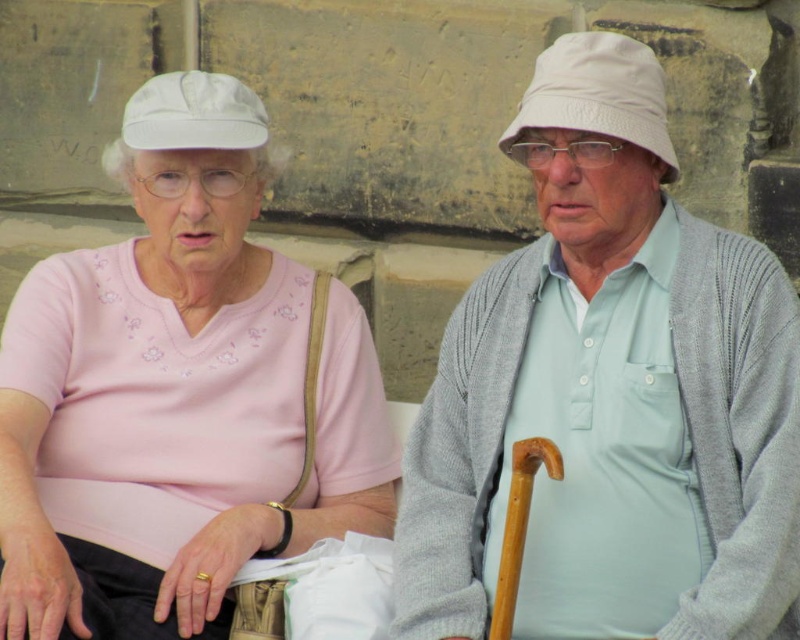
Question: Among these points, which one is farthest from the camera?

Choices:
 (A) (197, 540)
 (B) (146, 84)

Answer: (B)

Question: Which of the following is the closest to the observer?

Choices:
 (A) (612, 410)
 (B) (348, 513)

Answer: (A)

Question: Is matte pink shirt at center to the left of white fabric baseball hat at upper right from the viewer's perspective?

Choices:
 (A) no
 (B) yes

Answer: (B)

Question: Does light gray knit sweater at center appear on the right side of white fabric baseball cap at upper left?

Choices:
 (A) yes
 (B) no

Answer: (A)

Question: Where is light gray knit sweater at center located in relation to matte pink shirt at center in the image?

Choices:
 (A) below
 (B) above

Answer: (B)

Question: Which object appears farthest from the camera in this image?

Choices:
 (A) white fabric baseball cap at upper left
 (B) matte pink shirt at center
 (C) white fabric baseball hat at upper right

Answer: (A)